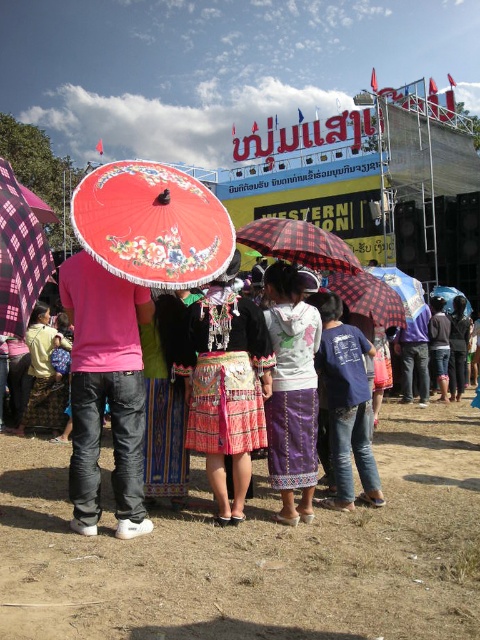
Question: Considering the real-world distances, which object is farthest from the matte black umbrella at center?

Choices:
 (A) dark blue jeans at center
 (B) matte pink parasol at center
 (C) checkered fabric umbrella at center
 (D) dark blue fabric shirt at center

Answer: (B)

Question: Which object is closer to the camera taking this photo?

Choices:
 (A) purple satin skirt at center
 (B) blue plaid umbrella at center
 (C) matte black umbrella at center
 (D) red painted wood parasol at center

Answer: (D)

Question: Is the position of dark blue fabric shirt at center less distant than that of matte black umbrella at center?

Choices:
 (A) no
 (B) yes

Answer: (A)

Question: Is blue cotton shirt at center above dark blue fabric shirt at center?

Choices:
 (A) yes
 (B) no

Answer: (B)

Question: Among these objects, which one is nearest to the camera?

Choices:
 (A) matte black umbrella at center
 (B) blue plaid umbrella at center
 (C) blue cotton shirt at center

Answer: (C)

Question: Is brown sandy ground at center thinner than dark blue jeans at center?

Choices:
 (A) yes
 (B) no

Answer: (B)